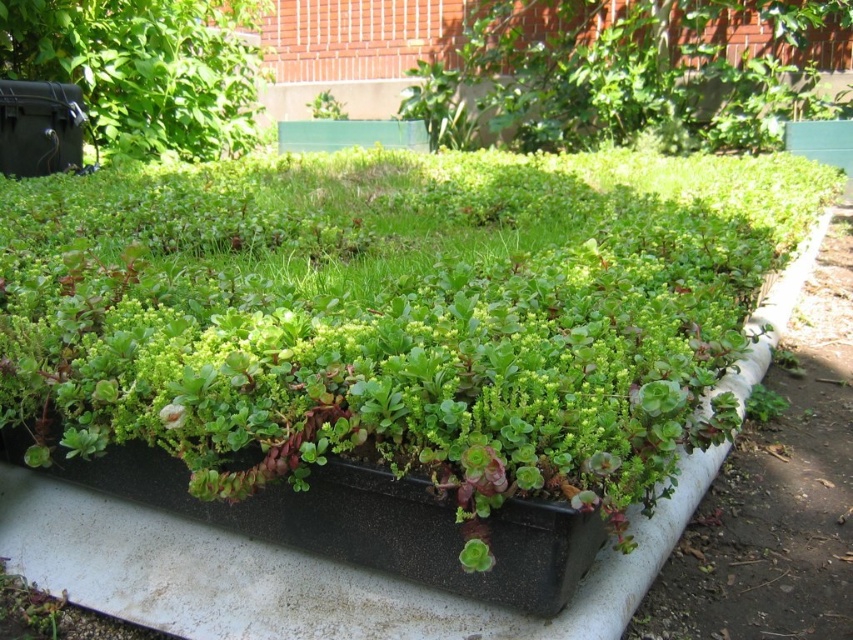
You are a gardener who wants to place a small decorative rock at the point marked as point [144,68]. Based on the scene, where exactly would this rock be placed?

The point [144,68] is on the black plastic container at upper left, so placing the rock there would put it on the black plastic container at upper left.